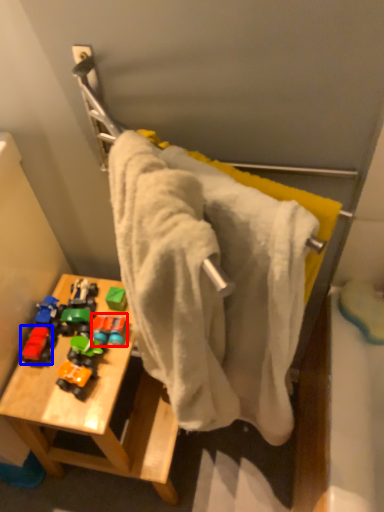
Question: Which point is further to the camera, toy (highlighted by a red box) or toy (highlighted by a blue box)?

Choices:
 (A) toy
 (B) toy

Answer: (A)